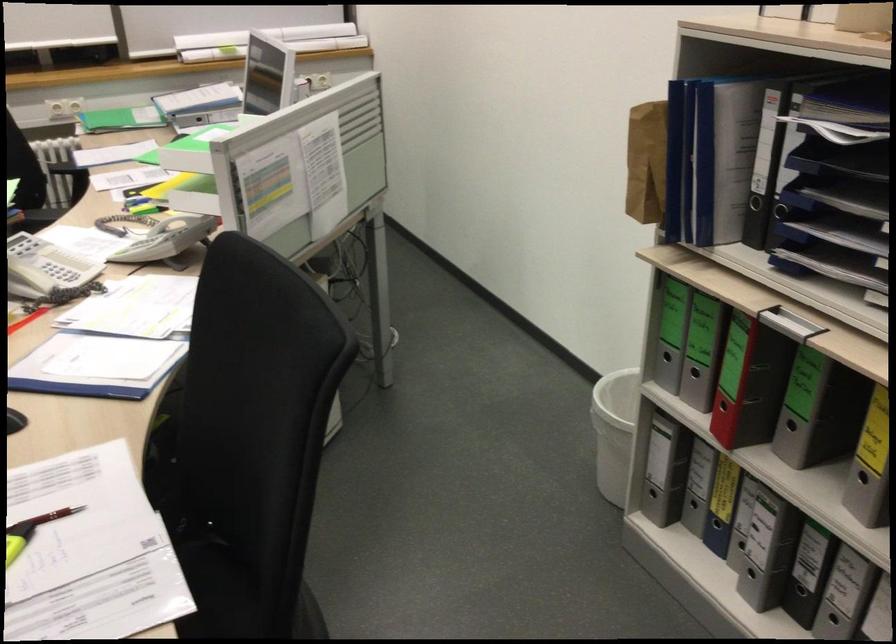
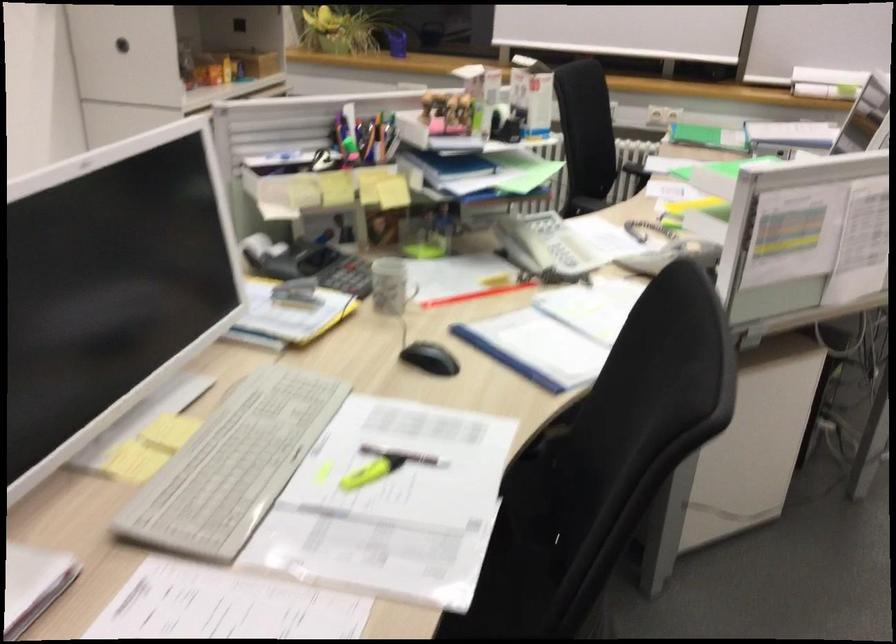
Locate, in the second image, the point that corresponds to point 182,561 in the first image.

(518, 554)